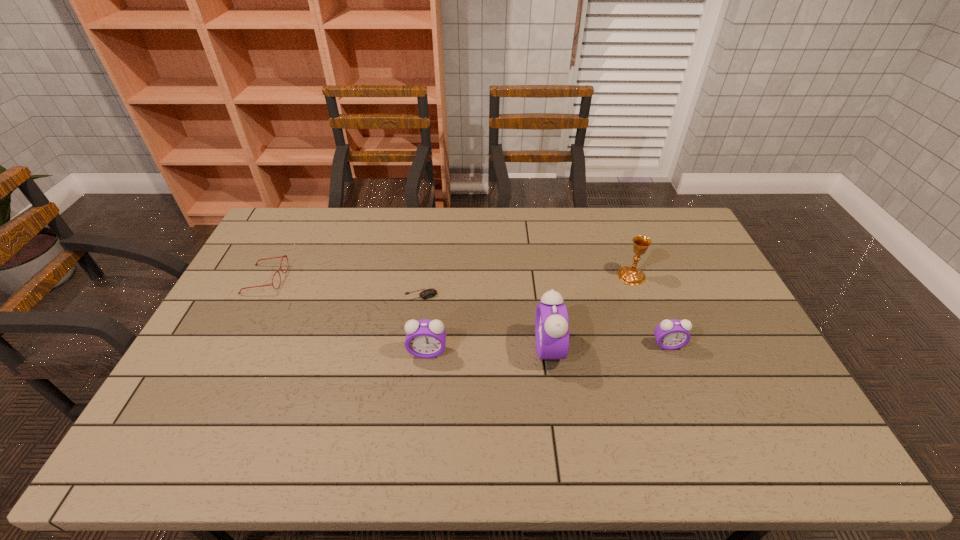
In order to click on the second shortest alarm clock in this screenshot , I will do `click(425, 338)`.

You are a GUI agent. You are given a task and a screenshot of the screen. Output one action in this format:
    pyautogui.click(x=<x>, y=<y>)
    Task: Click on the leftmost alarm clock
    This screenshot has width=960, height=540.
    Given the screenshot: What is the action you would take?
    pyautogui.click(x=425, y=338)

Locate an element on the screen. This screenshot has height=540, width=960. the tallest alarm clock is located at coordinates [x=551, y=321].

Identify the location of the tallest object. (551, 321).

This screenshot has width=960, height=540. In order to click on the shortest alarm clock in this screenshot , I will do `click(673, 334)`.

This screenshot has height=540, width=960. I want to click on the rightmost alarm clock, so click(673, 334).

At what (x,y) coordinates should I click in order to perform the action: click on the fifth shortest object. Please return your answer as a coordinate pair (x, y). Looking at the image, I should click on (630, 275).

The image size is (960, 540). Identify the location of the shortest object. (428, 293).

Find the location of `the fifth tallest object`. the fifth tallest object is located at coordinates (284, 255).

Where is `the leftmost object`? This screenshot has height=540, width=960. the leftmost object is located at coordinates (284, 255).